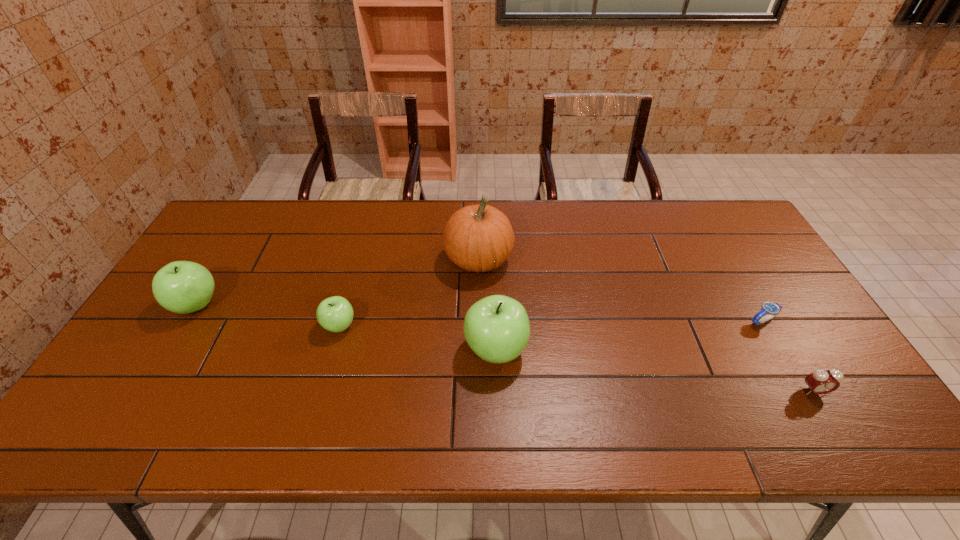
The image size is (960, 540). Find the location of `object present at the near right corner`. object present at the near right corner is located at coordinates (821, 381).

The width and height of the screenshot is (960, 540). In order to click on free location at the far edge of the desktop in this screenshot , I will do `click(269, 240)`.

Identify the location of vacant space at the near edge of the desktop. (777, 402).

Find the location of `vacant space at the right edge`. vacant space at the right edge is located at coordinates (731, 265).

This screenshot has width=960, height=540. In order to click on free location at the far left corner of the desktop in this screenshot , I will do `click(263, 220)`.

This screenshot has height=540, width=960. I want to click on vacant space at the far right corner of the desktop, so click(724, 217).

Find the location of a particular element. The image size is (960, 540). vacant point located between the rightmost apple and the alarm clock is located at coordinates (655, 370).

I want to click on vacant region between the shortest object and the alarm clock, so pyautogui.click(x=788, y=356).

At what (x,y) coordinates should I click in order to perform the action: click on free spot between the rightmost apple and the second apple from right to left. Please return your answer as a coordinate pair (x, y). This screenshot has height=540, width=960. Looking at the image, I should click on (418, 338).

This screenshot has width=960, height=540. I want to click on blank region between the watch and the rightmost apple, so click(629, 335).